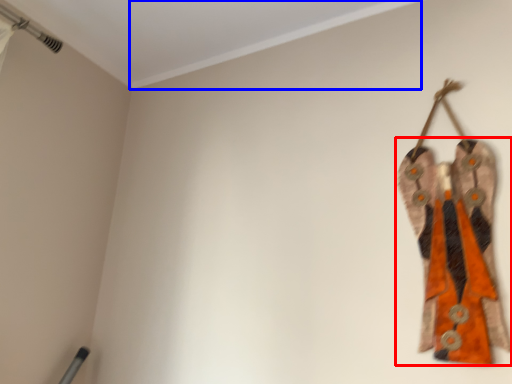
Question: Which point is further to the camera, fancy dress (highlighted by a red box) or trim (highlighted by a blue box)?

Choices:
 (A) fancy dress
 (B) trim

Answer: (A)